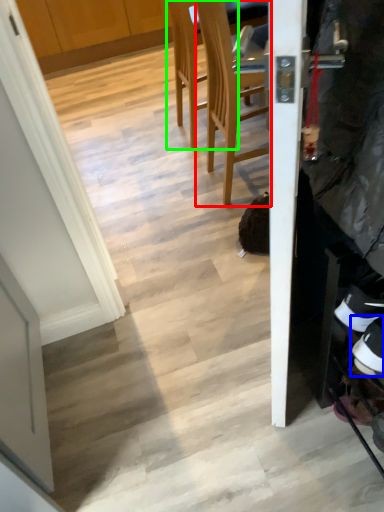
Question: Which is farther away from chair (highlighted by a red box)? footwear (highlighted by a blue box) or chair (highlighted by a green box)?

Choices:
 (A) footwear
 (B) chair

Answer: (A)